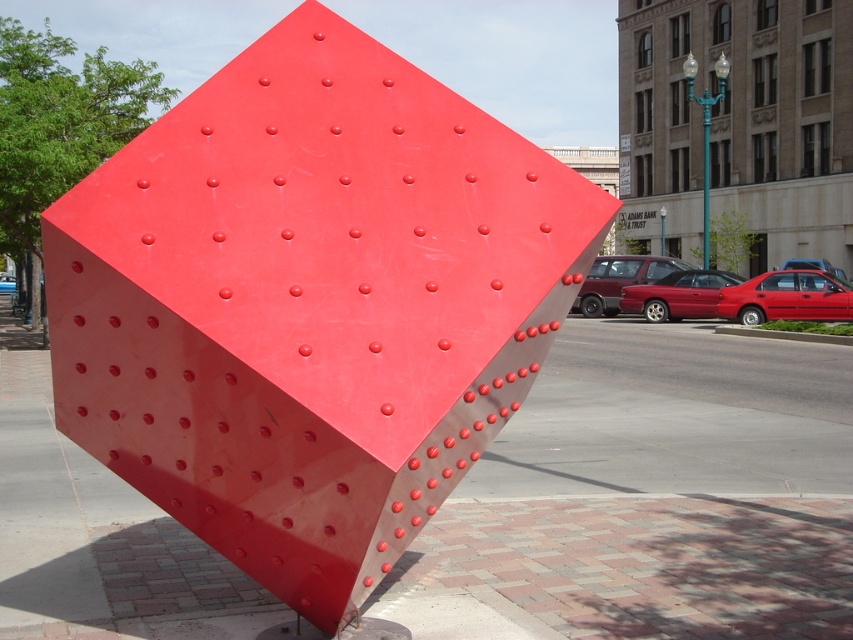
Is point (379, 289) farther from camera compared to point (804, 474)?

No, (379, 289) is in front of (804, 474).

Measure the distance between glossy red cube at center and glossy concrete pavement at center.

The distance of glossy red cube at center from glossy concrete pavement at center is 2.20 meters.

Find the location of a particular element. glossy red cube at center is located at coordinates (310, 304).